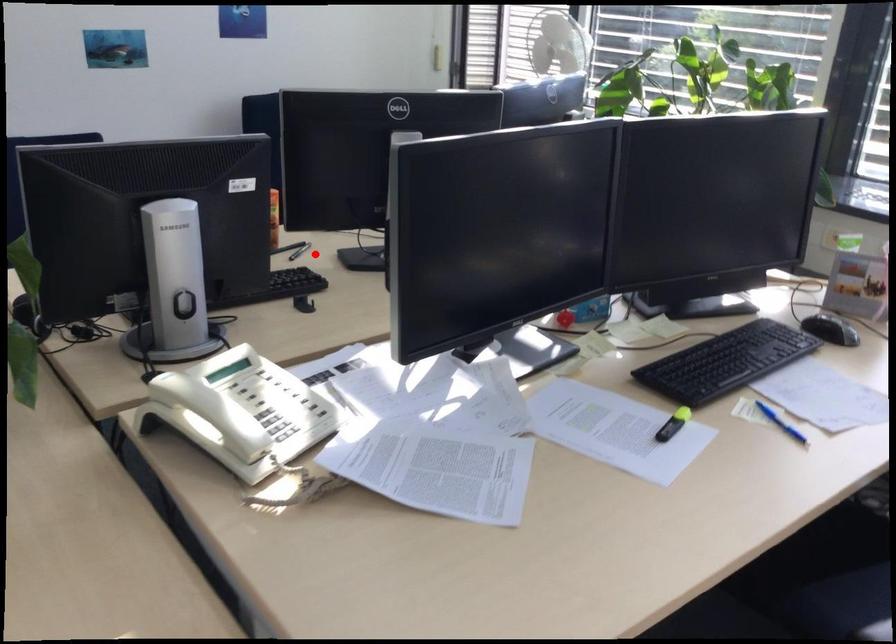
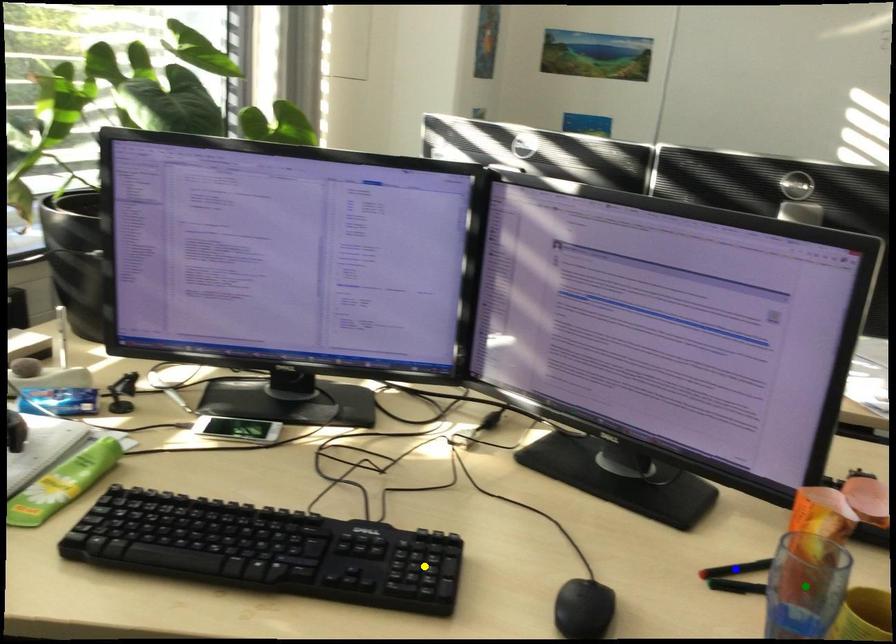
Question: I am providing you with two images of the same scene from different viewpoints. A red point is marked on the first image. You are given multiple points on the second image. Can you choose the point in image 2 that corresponds to the point in image 1?

Choices:
 (A) blue point
 (B) yellow point
 (C) green point

Answer: (A)